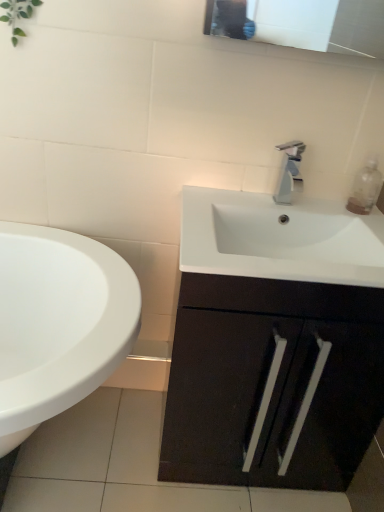
This screenshot has height=512, width=384. In order to click on vacant area that lies in front of clear plastic bottle at upper right in this screenshot , I will do `click(360, 222)`.